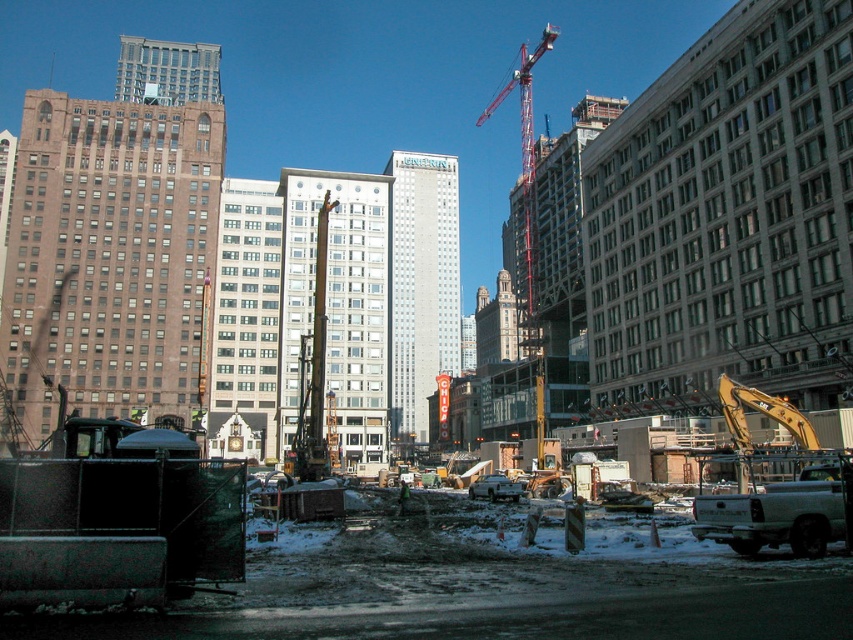
Who is higher up, metallic yellow excavator at center or green fabric construction worker at center?

Positioned higher is metallic yellow excavator at center.

Is metallic yellow excavator at center wider than green fabric construction worker at center?

Yes.

Which is behind, point (299, 428) or point (402, 500)?

The point (299, 428) is more distant.

I want to click on metallic yellow excavator at center, so click(x=312, y=372).

Is red metal crane at upper center to the left of green fabric construction worker at center from the viewer's perspective?

Incorrect, red metal crane at upper center is not on the left side of green fabric construction worker at center.

Which is in front, point (527, 220) or point (401, 493)?

Positioned in front is point (401, 493).

Where is `red metal crane at upper center`? red metal crane at upper center is located at coordinates (525, 168).

The width and height of the screenshot is (853, 640). What are the coordinates of `red metal crane at upper center` in the screenshot? It's located at (525, 168).

Who is higher up, metallic yellow excavator at center or red metal crane at upper center?

red metal crane at upper center is higher up.

Find the location of a particular element. The width and height of the screenshot is (853, 640). metallic yellow excavator at center is located at coordinates (312, 372).

Identify the location of metallic yellow excavator at center. The height and width of the screenshot is (640, 853). (312, 372).